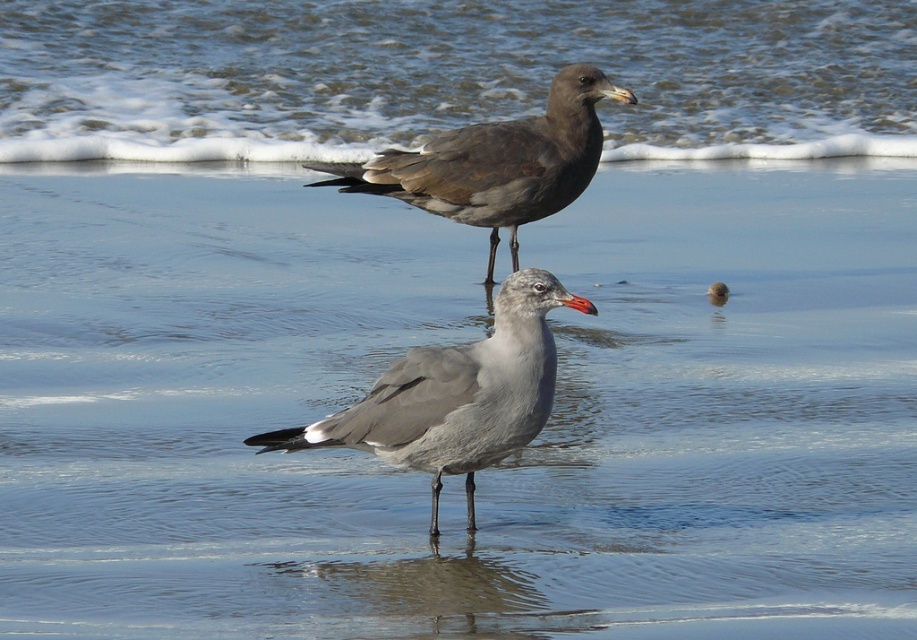
Can you confirm if clear water at upper center is wider than gray matte seagull at center?

Yes.

Which is more to the right, clear water at upper center or gray matte seagull at center?

clear water at upper center

Image resolution: width=917 pixels, height=640 pixels. What do you see at coordinates (449, 76) in the screenshot?
I see `clear water at upper center` at bounding box center [449, 76].

At what (x,y) coordinates should I click in order to perform the action: click on clear water at upper center. Please return your answer as a coordinate pair (x, y). The width and height of the screenshot is (917, 640). Looking at the image, I should click on (449, 76).

Who is lower down, gray matte seagull at center or dark brown feathers at upper center?

Positioned lower is gray matte seagull at center.

Is gray matte seagull at center thinner than dark brown feathers at upper center?

Yes.

Who is more distant from viewer, (x=507, y=358) or (x=485, y=152)?

Point (x=485, y=152)

Locate an element on the screen. This screenshot has width=917, height=640. gray matte seagull at center is located at coordinates pyautogui.click(x=455, y=396).

Between clear water at upper center and dark brown feathers at upper center, which one has more height?

clear water at upper center is taller.

Between clear water at upper center and dark brown feathers at upper center, which one is positioned lower?

Positioned lower is dark brown feathers at upper center.

Where is `clear water at upper center`? This screenshot has height=640, width=917. clear water at upper center is located at coordinates (449, 76).